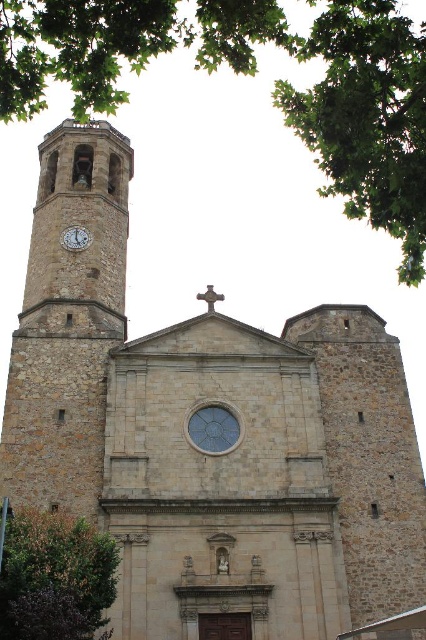
You are standing in front of the church and want to take a photo of the stone clock tower at left. If your camera can focus up to 50 meters, will it be able to capture the tower clearly?

The stone clock tower at left is 53.47 meters away from the viewer. Since the camera can only focus up to 50 meters, it will not be able to capture the tower clearly.

You are standing in front of the church and want to take a photo of both the stone clock tower at left and the green leafy tree at lower left. Which one should you adjust your camera angle to look up at or down at?

The stone clock tower at left is above the green leafy tree at lower left, so you should adjust your camera angle to look up at the stone clock tower at left and down at the green leafy tree at lower left.